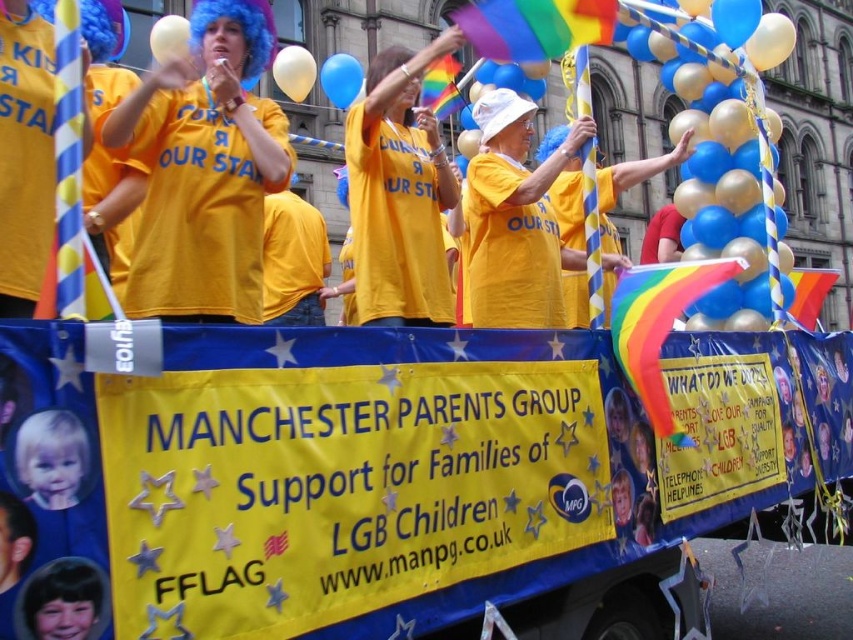
Question: Where is matte yellow t-shirt at upper center located in relation to yellow matte shirt at center in the image?

Choices:
 (A) above
 (B) below

Answer: (B)

Question: Does white glossy balloon at upper center appear on the right side of blue glossy balloon at upper center?

Choices:
 (A) yes
 (B) no

Answer: (B)

Question: Is matte yellow t-shirt at upper center smaller than blonde hair at lower left?

Choices:
 (A) no
 (B) yes

Answer: (A)

Question: Which point is farther from the camera taking this photo?

Choices:
 (A) (340, 83)
 (B) (178, 36)

Answer: (A)

Question: Which object is farther from the camera taking this photo?

Choices:
 (A) blonde hair at lower left
 (B) white glossy balloon at upper center
 (C) yellow matte shirt at center

Answer: (B)

Question: Estimate the real-world distances between objects in this image. Which object is closer to the matte yellow t-shirt at upper center?

Choices:
 (A) white glossy balloon at upper center
 (B) blue metallic balloons at upper right

Answer: (A)